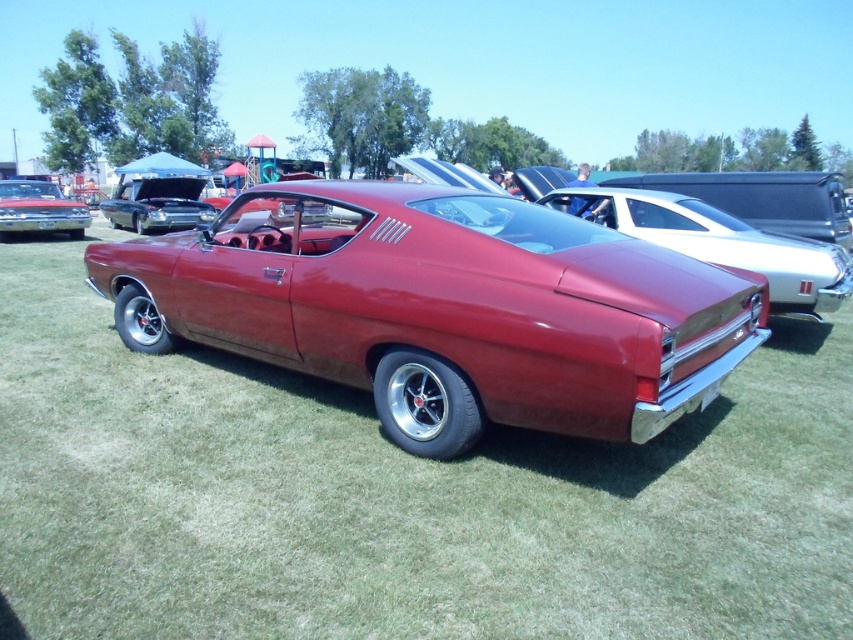
You are a photographer trying to capture the glossy red car at center and the shiny red car at center in a single shot. However, you notice that one of them is blocking the other. Which car is being obscured by the other?

The glossy red car at center is positioned under the shiny red car at center, so the glossy red car at center is being obscured by the shiny red car at center.

You are a photographer planning to take a photo of the shiny chrome car at upper left and the shiny red car at upper left. Which car should you focus on first if you want to capture the one closer to the camera?

The shiny chrome car at upper left is smaller than the shiny red car at upper left, so the shiny red car at upper left is closer to the camera and should be focused on first.

You are a photographer planning to take a photo of both the glossy metallic car at center and the shiny chrome car at upper left. Since you want to capture both cars in the same frame, which car should you position closer to the camera to ensure they appear the same size in the photo?

The glossy metallic car at center is wider than the shiny chrome car at upper left. To make them appear the same size in the photo, you should position the wider glossy metallic car at center farther away from the camera compared to the narrower shiny chrome car at upper left. This way, the distance compensates for the difference in their actual widths, resulting in both cars appearing equally sized in the final image.